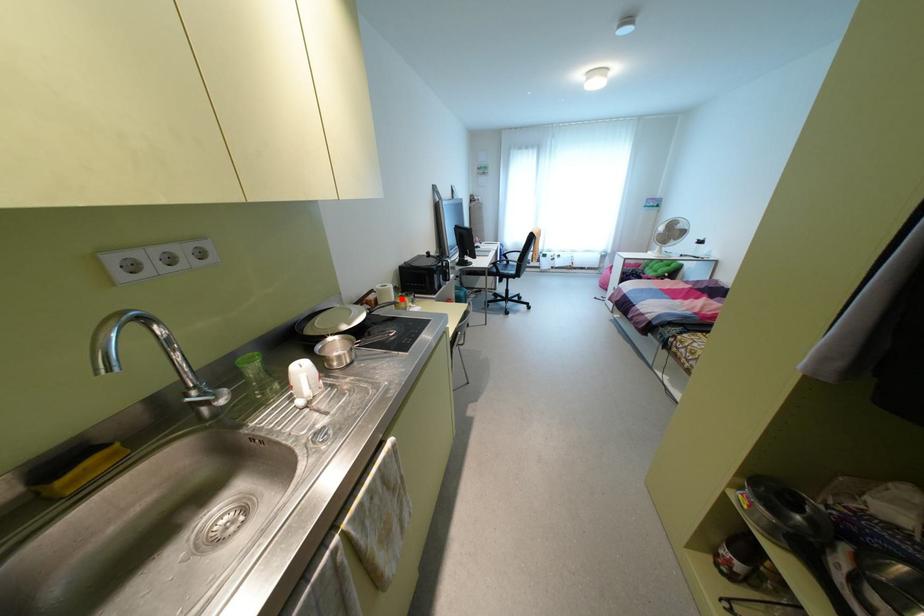
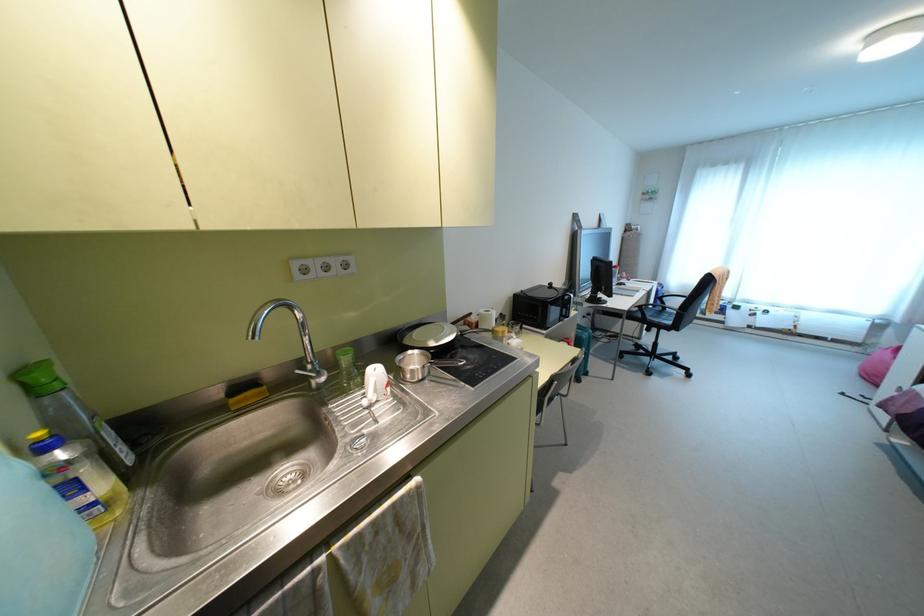
Question: A red point is marked in image1. In image2, is the corresponding 3D point closer to the camera or farther? Reply with the corresponding letter.

Choices:
 (A) The corresponding 3D point is closer.
 (B) The corresponding 3D point is farther.

Answer: (B)